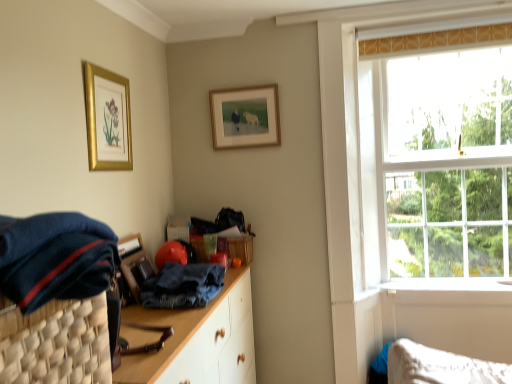
The width and height of the screenshot is (512, 384). What do you see at coordinates (436, 154) in the screenshot?
I see `clear glass window at upper right` at bounding box center [436, 154].

Measure the distance between point (x=12, y=294) and camera.

They are 24.88 inches apart.

At what (x,y) coordinates should I click in order to perform the action: click on denim at center, which is the 1th clothing in bottom-to-top order. Please return your answer as a coordinate pair (x, y). Looking at the image, I should click on (183, 286).

Where is `gold-framed picture at upper center, arranged as the 2th picture frame when viewed from the front`? The image size is (512, 384). gold-framed picture at upper center, arranged as the 2th picture frame when viewed from the front is located at coordinates [x=245, y=117].

The width and height of the screenshot is (512, 384). Find the location of `wooden cabinet at center`. wooden cabinet at center is located at coordinates (198, 340).

Considering the sizes of dark blue fabric at left, positioned as the first clothing in front-to-back order, and dark blue woven basket at left in the image, is dark blue fabric at left, positioned as the first clothing in front-to-back order, taller or shorter than dark blue woven basket at left?

In the image, dark blue fabric at left, positioned as the first clothing in front-to-back order, appears to be shorter than dark blue woven basket at left.

This screenshot has width=512, height=384. What are the coordinates of `basket on the left of the dark blue fabric at left, the 2th clothing in the back-to-front sequence` in the screenshot? It's located at (56, 343).

Looking at this image, how different are the orientations of dark blue fabric at left, the 2th clothing in the back-to-front sequence, and dark blue woven basket at left in degrees?

The angle between the facing direction of dark blue fabric at left, the 2th clothing in the back-to-front sequence, and the facing direction of dark blue woven basket at left is 0.000482 degrees.

Consider the image. Which is nearer, (x=83, y=252) or (x=79, y=307)?

Point (x=83, y=252) is closer to the camera than point (x=79, y=307).

Is clear glass window at upper right smaller than dark blue woven basket at left?

Incorrect, clear glass window at upper right is not smaller in size than dark blue woven basket at left.

Image resolution: width=512 pixels, height=384 pixels. I want to click on basket located in front of the clear glass window at upper right, so click(56, 343).

How different are the orientations of clear glass window at upper right and dark blue woven basket at left in degrees?

The angular difference between clear glass window at upper right and dark blue woven basket at left is 90.3 degrees.

From the image's perspective, is clear glass window at upper right located above or below dark blue woven basket at left?

From the image's perspective, clear glass window at upper right appears above dark blue woven basket at left.

From the image's perspective, is denim at center, positioned as the second clothing in front-to-back order, on top of clear glass window at upper right?

No, from the image's perspective, denim at center, positioned as the second clothing in front-to-back order, is not on top of clear glass window at upper right.

From their relative heights in the image, would you say denim at center, positioned as the second clothing in front-to-back order, is taller or shorter than clear glass window at upper right?

denim at center, positioned as the second clothing in front-to-back order, is shorter than clear glass window at upper right.

From a real-world perspective, which is physically below, denim at center, which ranks as the 1th clothing in back-to-front order, or clear glass window at upper right?

From a 3D spatial view, denim at center, which ranks as the 1th clothing in back-to-front order, is below.

In the image, is dark blue fabric at left, the 2th clothing in the back-to-front sequence, on the left side or the right side of gold-framed picture at upper center, placed as the second picture frame when sorted from left to right?

dark blue fabric at left, the 2th clothing in the back-to-front sequence, is to the left of gold-framed picture at upper center, placed as the second picture frame when sorted from left to right.

In terms of size, does dark blue fabric at left, positioned as the first clothing in front-to-back order, appear bigger or smaller than gold-framed picture at upper center, acting as the 1th picture frame starting from the back?

dark blue fabric at left, positioned as the first clothing in front-to-back order, is bigger than gold-framed picture at upper center, acting as the 1th picture frame starting from the back.

In the scene shown: Which object is further away from the camera, dark blue fabric at left, the 2th clothing in the back-to-front sequence, or gold-framed picture at upper center, placed as the second picture frame when sorted from left to right?

gold-framed picture at upper center, placed as the second picture frame when sorted from left to right, is behind.

Is point (82, 284) positioned after point (245, 115)?

That is False.

Can you confirm if denim at center, positioned as the 2th clothing in top-to-bottom order, is wider than dark blue fabric at left, the 2th clothing in the back-to-front sequence?

In fact, denim at center, positioned as the 2th clothing in top-to-bottom order, might be narrower than dark blue fabric at left, the 2th clothing in the back-to-front sequence.

From a real-world perspective, which is physically above, denim at center, which is the 1th clothing in bottom-to-top order, or dark blue fabric at left, which is the 1th clothing in top-to-bottom order?

From a 3D spatial view, dark blue fabric at left, which is the 1th clothing in top-to-bottom order, is above.

How many degrees apart are the facing directions of denim at center, which is the 1th clothing in bottom-to-top order, and dark blue fabric at left, the 2th clothing in the back-to-front sequence?

The facing directions of denim at center, which is the 1th clothing in bottom-to-top order, and dark blue fabric at left, the 2th clothing in the back-to-front sequence, are 4.02 degrees apart.

Measure the distance from denim at center, positioned as the 2th clothing in top-to-bottom order, to dark blue fabric at left, which is counted as the 2th clothing, starting from the bottom.

They are 33.64 inches apart.

From the image's perspective, is denim at center, positioned as the second clothing in front-to-back order, located above dark blue woven basket at left?

No, from the image's perspective, denim at center, positioned as the second clothing in front-to-back order, is not on top of dark blue woven basket at left.

Does denim at center, positioned as the second clothing in front-to-back order, turn towards dark blue woven basket at left?

No, denim at center, positioned as the second clothing in front-to-back order, is not aimed at dark blue woven basket at left.

From a real-world perspective, which object rests below the other?

denim at center, which is the 1th clothing in bottom-to-top order, from a real-world perspective.

Is denim at center, positioned as the second clothing in front-to-back order, bigger than wooden cabinet at center?

No.

Considering the relative positions of denim at center, positioned as the 2th clothing in top-to-bottom order, and wooden cabinet at center in the image provided, is denim at center, positioned as the 2th clothing in top-to-bottom order, in front of wooden cabinet at center?

No, it is behind wooden cabinet at center.

From the image's perspective, is denim at center, positioned as the second clothing in front-to-back order, over wooden cabinet at center?

Yes, from the image's perspective, denim at center, positioned as the second clothing in front-to-back order, is above wooden cabinet at center.

Where is `the 1st clothing counting from the right side of the dark blue woven basket at left`? The width and height of the screenshot is (512, 384). the 1st clothing counting from the right side of the dark blue woven basket at left is located at coordinates (55, 258).

Identify the location of basket located below the clear glass window at upper right (from the image's perspective). (56, 343).

Which object lies further to the anchor point gold-framed picture at upper center, placed as the second picture frame when sorted from left to right, dark blue woven basket at left or dark blue fabric at left, which is counted as the 2th clothing, starting from the bottom?

dark blue woven basket at left lies further to gold-framed picture at upper center, placed as the second picture frame when sorted from left to right, than the other object.

Estimate the real-world distances between objects in this image. Which object is closer to dark blue fabric at left, positioned as the first clothing in front-to-back order, clear glass window at upper right or dark blue woven basket at left?

Among the two, dark blue woven basket at left is located nearer to dark blue fabric at left, positioned as the first clothing in front-to-back order.

Based on their spatial positions, is clear glass window at upper right or gold-framed picture at upper center, placed as the second picture frame when sorted from left to right, further from wooden cabinet at center?

clear glass window at upper right.

Which object lies further to the anchor point denim at center, positioned as the 2th clothing in top-to-bottom order, gold metallic picture frame at upper left, which is the 1th picture frame from left to right, or gold-framed picture at upper center, placed as the second picture frame when sorted from left to right?

The object further to denim at center, positioned as the 2th clothing in top-to-bottom order, is gold-framed picture at upper center, placed as the second picture frame when sorted from left to right.

Based on their spatial positions, is gold-framed picture at upper center, placed as the second picture frame when sorted from left to right, or dark blue woven basket at left further from dark blue fabric at left, positioned as the first clothing in front-to-back order?

gold-framed picture at upper center, placed as the second picture frame when sorted from left to right, lies further to dark blue fabric at left, positioned as the first clothing in front-to-back order, than the other object.

Considering their positions, is dark blue fabric at left, which is counted as the 2th clothing, starting from the bottom, positioned further to denim at center, positioned as the second clothing in front-to-back order, than dark blue woven basket at left?

Based on the image, dark blue fabric at left, which is counted as the 2th clothing, starting from the bottom, appears to be further to denim at center, positioned as the second clothing in front-to-back order.

When comparing their distances from dark blue woven basket at left, does denim at center, which ranks as the 1th clothing in back-to-front order, or gold metallic picture frame at upper left, the second picture frame positioned from the right, seem closer?

denim at center, which ranks as the 1th clothing in back-to-front order, lies closer to dark blue woven basket at left than the other object.

From the image, which object appears to be nearer to wooden cabinet at center, gold metallic picture frame at upper left, which is the 1th picture frame from left to right, or dark blue woven basket at left?

dark blue woven basket at left lies closer to wooden cabinet at center than the other object.

Where is `picture frame between gold-framed picture at upper center, placed as the second picture frame when sorted from left to right, and denim at center, which ranks as the 1th clothing in back-to-front order, from top to bottom`? picture frame between gold-framed picture at upper center, placed as the second picture frame when sorted from left to right, and denim at center, which ranks as the 1th clothing in back-to-front order, from top to bottom is located at coordinates (106, 119).

You are a GUI agent. You are given a task and a screenshot of the screen. Output one action in this format:
    pyautogui.click(x=<x>, y=<y>)
    Task: Click on the basket between gold metallic picture frame at upper left, the second picture frame positioned from the right, and wooden cabinet at center in the up-down direction
    This screenshot has height=384, width=512.
    Given the screenshot: What is the action you would take?
    pyautogui.click(x=56, y=343)

The height and width of the screenshot is (384, 512). Find the location of `picture frame located between gold metallic picture frame at upper left, which is the 1th picture frame from left to right, and clear glass window at upper right in the left-right direction`. picture frame located between gold metallic picture frame at upper left, which is the 1th picture frame from left to right, and clear glass window at upper right in the left-right direction is located at coordinates (245, 117).

What are the coordinates of `clothing located between dark blue fabric at left, the 2th clothing in the back-to-front sequence, and gold metallic picture frame at upper left, the second picture frame positioned from the right, in the depth direction` in the screenshot? It's located at (183, 286).